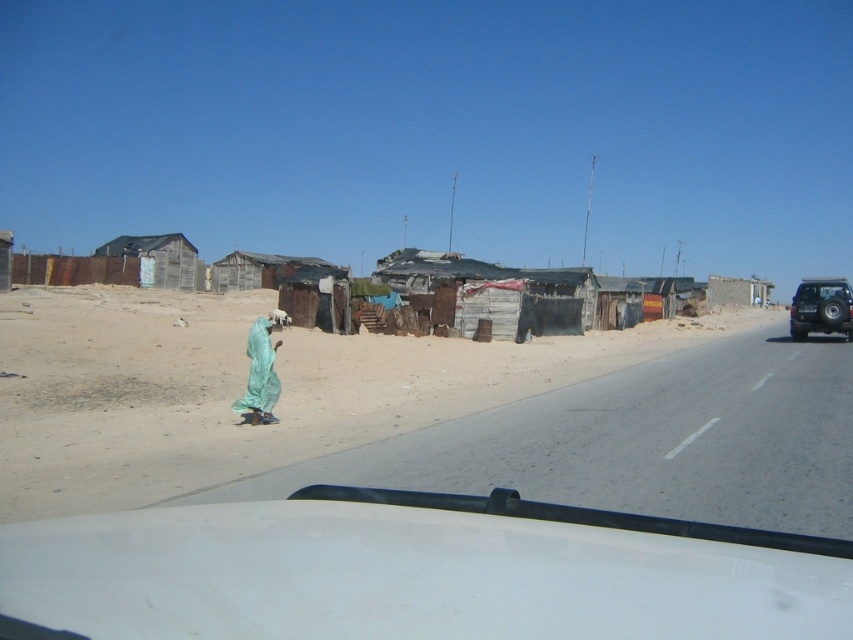
You are driving a car and need to park it near the green fabric at center. The parking spot requires a vehicle to be within 5 meters of the fabric. Can your white matte car at lower center park there?

The distance between the white matte car at lower center and the green fabric at center is 7.31 meters, which exceeds the 5 meter requirement. Therefore, the white matte car at lower center cannot park in that spot.

You are driving a car and looking out the windshield. You see the brown dirt at lower left and the green fabric at center. Which object is wider?

The brown dirt at lower left is wider than the green fabric at center.

You are a driver inside the vehicle looking out. The brown dirt at lower left and the brushed metal jeep at right are both visible through the windshield. Which object is higher in the scene?

The brown dirt at lower left is much taller than the brushed metal jeep at right, so the brown dirt at lower left is higher in the scene.